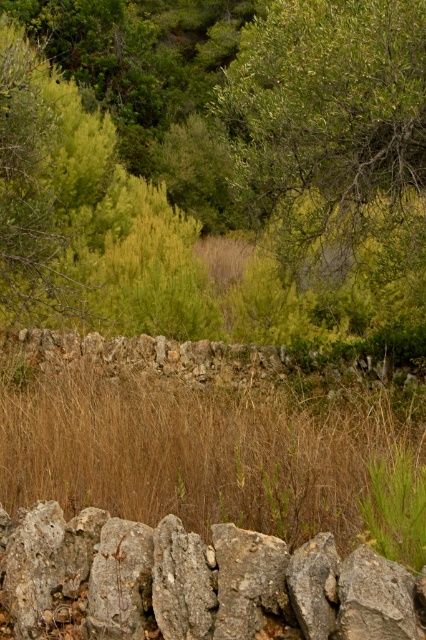
Does point (423, 237) come closer to viewer compared to point (408, 500)?

No, (423, 237) is further to viewer.

At what (x,y) coordinates should I click in order to perform the action: click on green leafy tree at center. Please return your answer as a coordinate pair (x, y). This screenshot has width=426, height=640. Looking at the image, I should click on (213, 163).

Locate an element on the screen. This screenshot has height=640, width=426. green leafy tree at center is located at coordinates (213, 163).

Between gray rough stone at center and green grass at center, which one is positioned higher?

green grass at center

What do you see at coordinates (192, 582) in the screenshot?
I see `gray rough stone at center` at bounding box center [192, 582].

Is point (175, 568) positioned before point (382, 541)?

Yes, it is in front of point (382, 541).

Where is `gray rough stone at center`? This screenshot has width=426, height=640. gray rough stone at center is located at coordinates (192, 582).

Looking at this image, which of these two, green leafy tree at center or brown dry grass at center, stands shorter?

With less height is brown dry grass at center.

Is green leafy tree at center closer to camera compared to brown dry grass at center?

No, green leafy tree at center is behind brown dry grass at center.

Who is more distant from viewer, (294,6) or (400,468)?

Point (294,6)

At what (x,y) coordinates should I click in order to perform the action: click on green leafy tree at center. Please return your answer as a coordinate pair (x, y). This screenshot has width=426, height=640. Looking at the image, I should click on [213, 163].